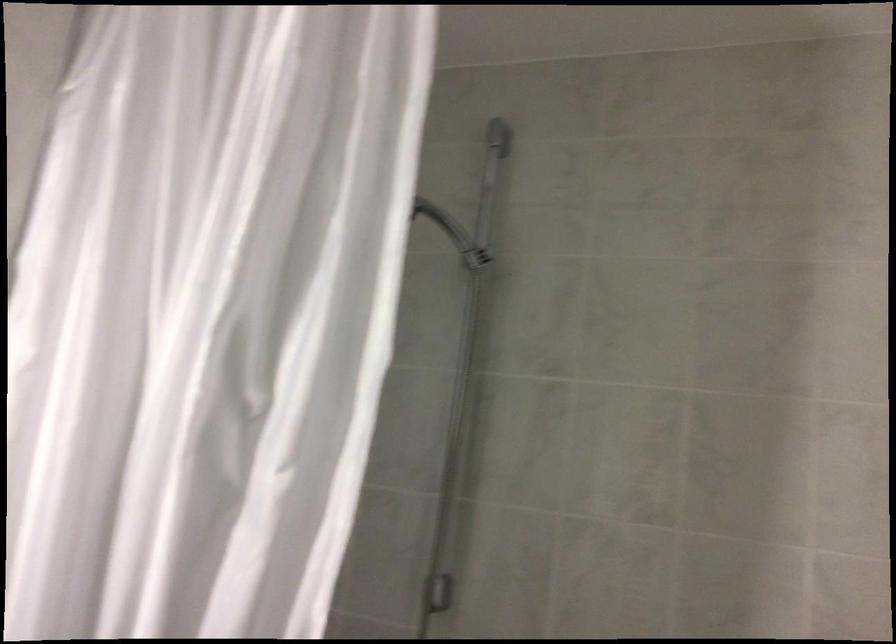
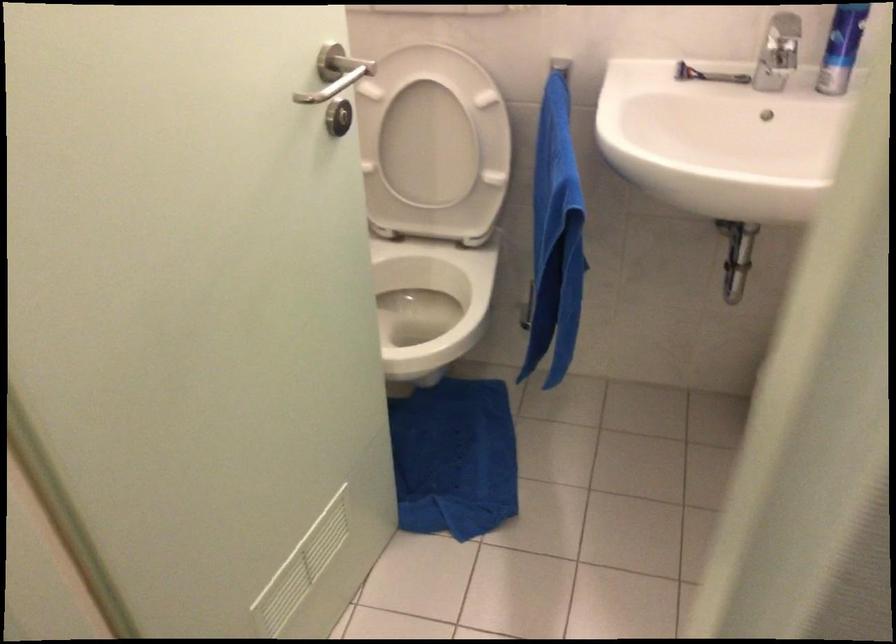
Looking at this image, the images are taken continuously from a first-person perspective. In which direction is your viewpoint rotating?

The camera's rotation is toward left-down.